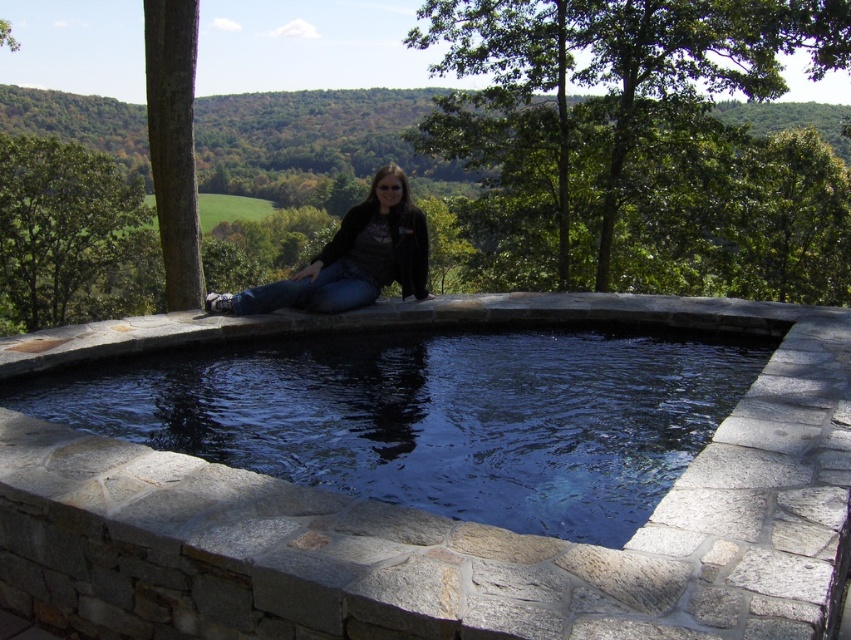
From the picture: Is dark stone pool at center thinner than denim jeans at center?

No, dark stone pool at center is not thinner than denim jeans at center.

Which of these two, dark stone pool at center or denim jeans at center, stands shorter?

dark stone pool at center is shorter.

Is point (561, 483) more distant than point (395, 198)?

No, (561, 483) is in front of (395, 198).

Image resolution: width=851 pixels, height=640 pixels. Find the location of `dark stone pool at center`. dark stone pool at center is located at coordinates (433, 413).